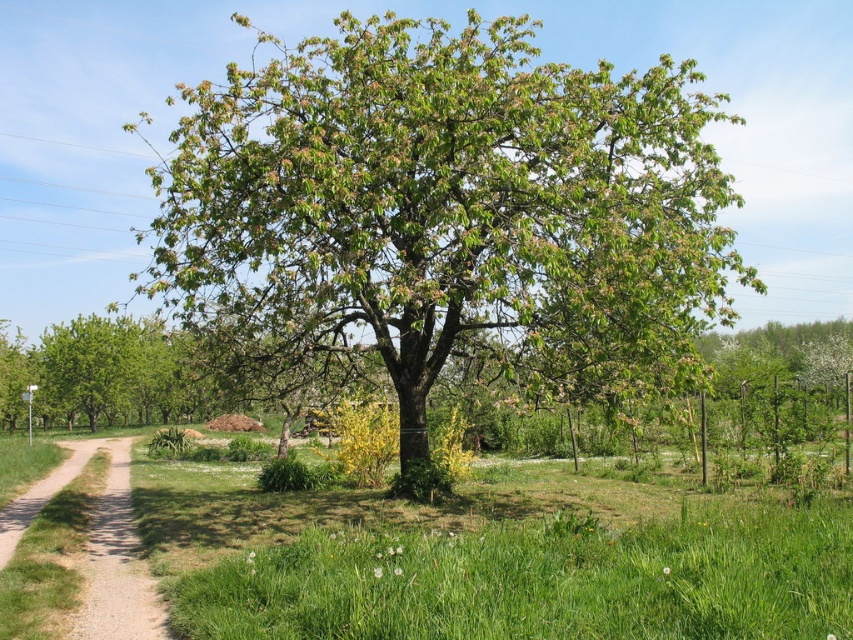
Does green leafy tree at center have a lesser height compared to dirt/gravel path at left?

Incorrect, green leafy tree at center's height does not fall short of dirt/gravel path at left's.

Is point (283, 310) farther from viewer compared to point (90, 550)?

That is True.

At what (x,y) coordinates should I click in order to perform the action: click on green leafy tree at center. Please return your answer as a coordinate pair (x, y). Looking at the image, I should click on (450, 209).

Is green leafy tree at center taller than green grass at center?

Yes.

In the scene shown: Does green leafy tree at center lie behind green grass at center?

Yes.

Find the location of a particular element. The height and width of the screenshot is (640, 853). green leafy tree at center is located at coordinates (450, 209).

Does dirt/gravel path at left have a lesser width compared to green leafy tree at left?

No.

Does point (61, 577) come farther from viewer compared to point (85, 324)?

No, (61, 577) is in front of (85, 324).

The height and width of the screenshot is (640, 853). Describe the element at coordinates (100, 556) in the screenshot. I see `dirt/gravel path at left` at that location.

Where is `dirt/gravel path at left`? The image size is (853, 640). dirt/gravel path at left is located at coordinates (100, 556).